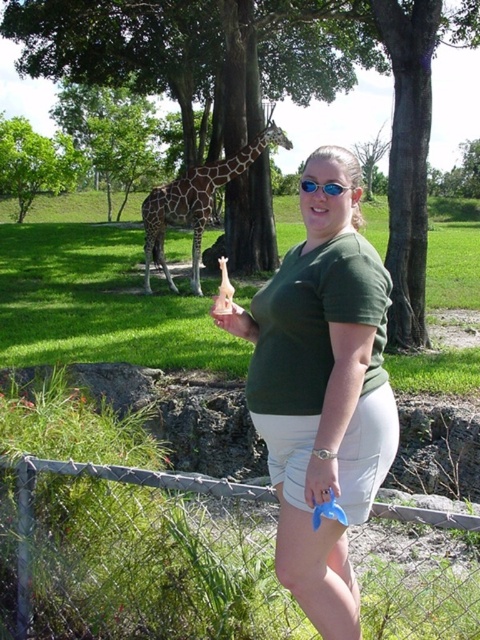
Based on the photo, you are a photographer trying to capture a clear shot of both the woman and the giraffe in the scene. Based on their positions, which of the two points, point 1 at coordinates point (28, 513) or point 2 at coordinates point (224, 330), is closer to the camera?

Point 1 at coordinates point (28, 513) is closer to the camera than point 2 at coordinates point (224, 330).